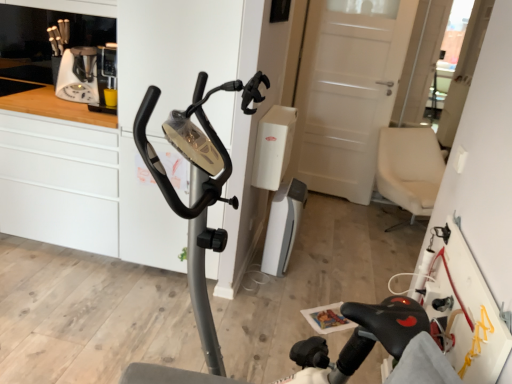
Question: Is white plastic coffee machine at upper left at the left side of white glossy dresser at center?

Choices:
 (A) yes
 (B) no

Answer: (A)

Question: From a real-world perspective, is white plastic coffee machine at upper left over white glossy dresser at center?

Choices:
 (A) no
 (B) yes

Answer: (B)

Question: Is the depth of white plastic coffee machine at upper left greater than that of white glossy dresser at center?

Choices:
 (A) yes
 (B) no

Answer: (A)

Question: Is white plastic coffee machine at upper left wider than white glossy dresser at center?

Choices:
 (A) yes
 (B) no

Answer: (B)

Question: From the image's perspective, is white plastic coffee machine at upper left above white glossy dresser at center?

Choices:
 (A) yes
 (B) no

Answer: (A)

Question: In terms of height, does white plastic vacuum cleaner at center look taller or shorter compared to white plastic coffee machine at upper left?

Choices:
 (A) tall
 (B) short

Answer: (A)

Question: Relative to white plastic coffee machine at upper left, is white plastic vacuum cleaner at center in front or behind?

Choices:
 (A) front
 (B) behind

Answer: (B)

Question: Is white plastic vacuum cleaner at center spatially inside white plastic coffee machine at upper left, or outside of it?

Choices:
 (A) outside
 (B) inside

Answer: (A)

Question: Is point (305, 193) positioned closer to the camera than point (71, 87)?

Choices:
 (A) farther
 (B) closer

Answer: (A)

Question: Do you think white glossy dresser at center is within metallic gray stationary bicycle at center, or outside of it?

Choices:
 (A) inside
 (B) outside

Answer: (B)

Question: Looking at the image, does white glossy dresser at center seem bigger or smaller compared to metallic gray stationary bicycle at center?

Choices:
 (A) small
 (B) big

Answer: (B)

Question: Considering the positions of white glossy dresser at center and metallic gray stationary bicycle at center in the image, is white glossy dresser at center wider or thinner than metallic gray stationary bicycle at center?

Choices:
 (A) wide
 (B) thin

Answer: (B)

Question: Considering the positions of point coord(180,82) and point coord(155,370), is point coord(180,82) closer or farther from the camera than point coord(155,370)?

Choices:
 (A) closer
 (B) farther

Answer: (B)

Question: Does point click(282, 188) appear closer or farther from the camera than point click(188, 249)?

Choices:
 (A) closer
 (B) farther

Answer: (B)

Question: Is white plastic vacuum cleaner at center in front of or behind metallic gray stationary bicycle at center in the image?

Choices:
 (A) front
 (B) behind

Answer: (B)